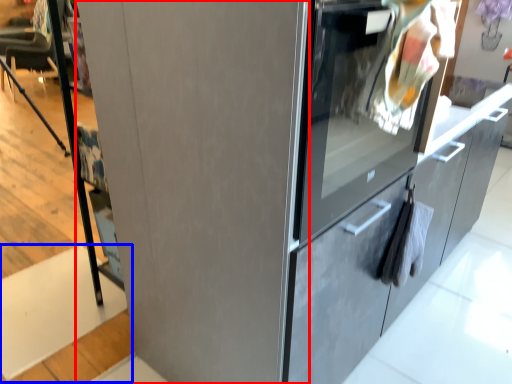
Question: Which object appears closest to the camera in this image, door (highlighted by a red box) or stair (highlighted by a blue box)?

Choices:
 (A) door
 (B) stair

Answer: (A)